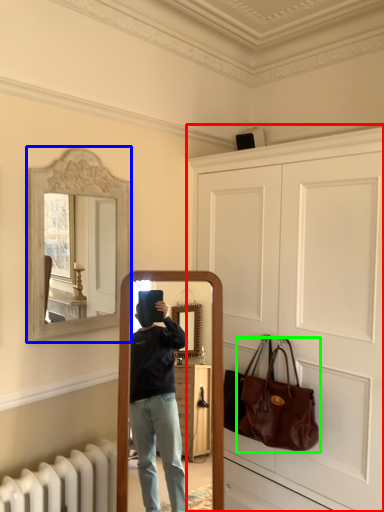
Question: Based on their relative distances, which object is nearer to door (highlighted by a red box)? Choose from picture frame (highlighted by a blue box) and handbag (highlighted by a green box).

Choices:
 (A) picture frame
 (B) handbag

Answer: (B)